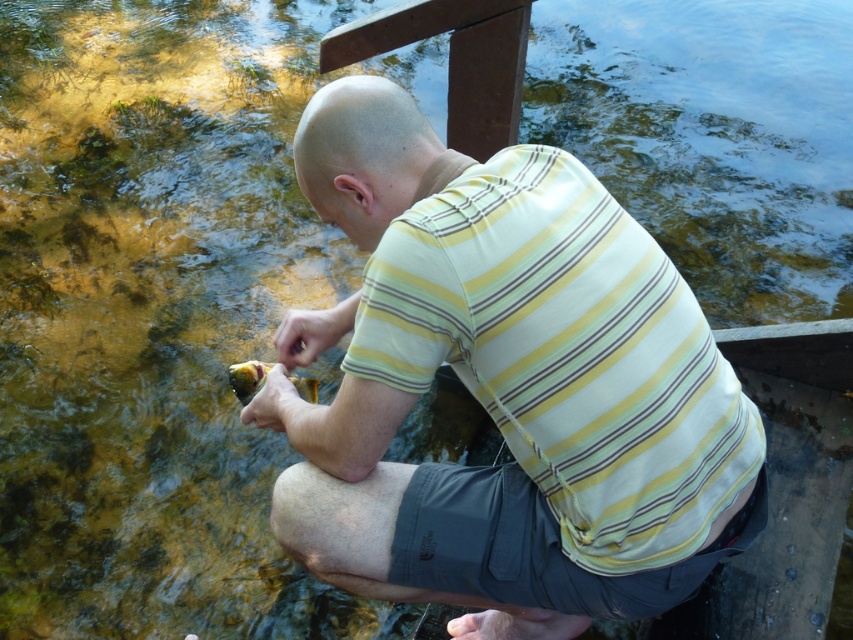
What are the coordinates of the yellow striped shirt at center?

The yellow striped shirt at center is located at point [500,384].

You are a photographer trying to capture the man in the yellow striped shirt at center and the shiny yellow fish at lower left. Since both are yellow, you want to ensure the fish is visible in the photo. Based on their positions, will the fish be clearly visible against the shirt?

The yellow striped shirt at center is in front of the shiny yellow fish at lower left, so the fish may not be clearly visible as it is partially obscured by the shirt.

You are a photographer trying to capture the shiny yellow fish at lower left in the image. The man in the yellow striped shirt at center is blocking your view. Can you determine if the fish is visible from your current position?

The yellow striped shirt at center is located above the shiny yellow fish at lower left, so the fish is partially or fully blocked by the shirt and may not be visible from your current position.